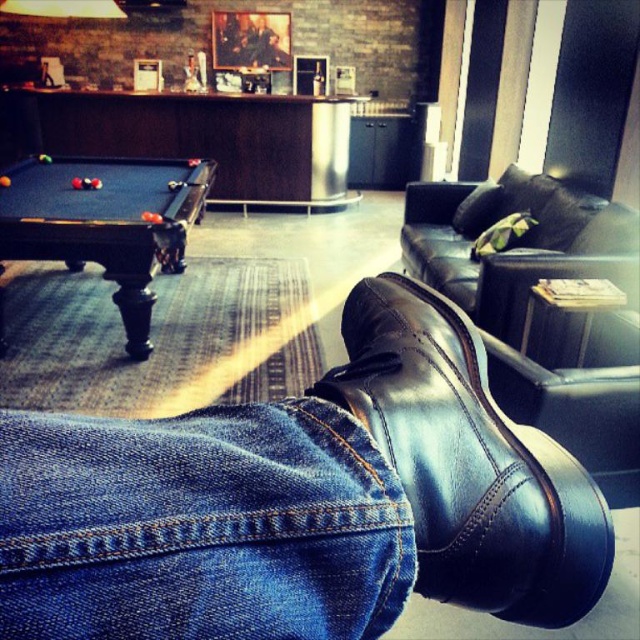
Question: From the image, what is the correct spatial relationship of denim at lower right in relation to shiny black shoe at lower right?

Choices:
 (A) above
 (B) below

Answer: (B)

Question: Which point is farther from the camera taking this photo?

Choices:
 (A) (472, 362)
 (B) (186, 440)
 (C) (88, 182)

Answer: (C)

Question: Estimate the real-world distances between objects in this image. Which object is farther from the black wooden pool table at left?

Choices:
 (A) shiny black shoe at lower right
 (B) denim at lower right

Answer: (B)

Question: Can you confirm if denim at lower right is thinner than black wooden pool table at left?

Choices:
 (A) no
 (B) yes

Answer: (B)

Question: Can you confirm if denim at lower right is positioned to the right of shiny black shoe at lower right?

Choices:
 (A) no
 (B) yes

Answer: (A)

Question: Which point is farther to the camera?

Choices:
 (A) black wooden pool table at left
 (B) shiny black shoe at lower right

Answer: (A)